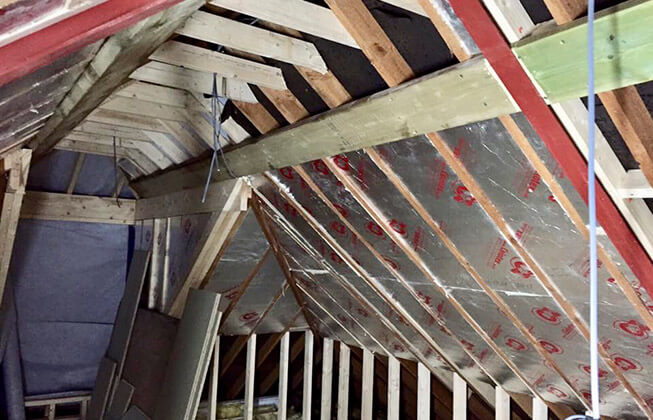
Find the location of a particular element. This screenshot has height=420, width=653. shadow from beam is located at coordinates (614, 23), (616, 75).